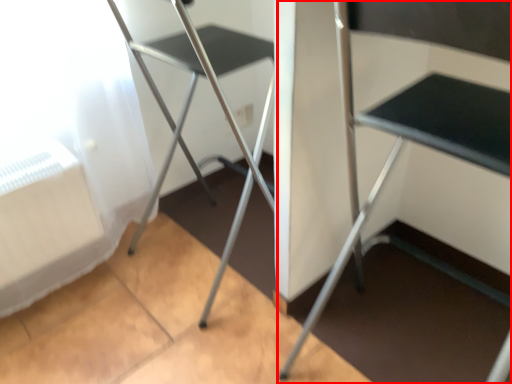
Question: From the image's perspective, where is furniture (annotated by the red box) located relative to chair?

Choices:
 (A) above
 (B) below

Answer: (B)